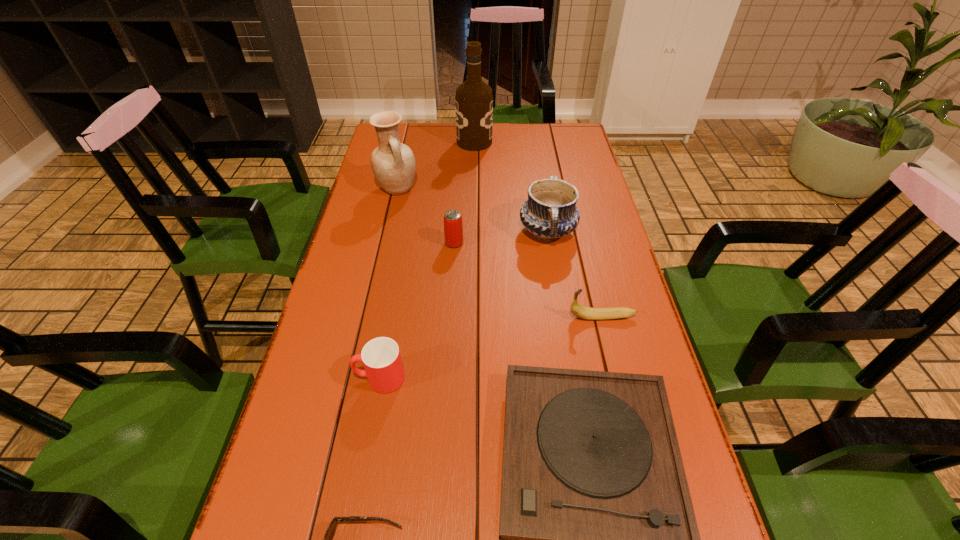
I want to click on pottery that is positioned at the left edge, so click(393, 163).

This screenshot has height=540, width=960. In order to click on cup that is at the left edge in this screenshot , I will do `click(381, 358)`.

Where is `pottery that is at the right edge`? The width and height of the screenshot is (960, 540). pottery that is at the right edge is located at coordinates click(550, 212).

Where is `banana that is positioned at the right edge`? The height and width of the screenshot is (540, 960). banana that is positioned at the right edge is located at coordinates (587, 313).

Where is `free region at the far edge of the desktop`? free region at the far edge of the desktop is located at coordinates coord(456,154).

The height and width of the screenshot is (540, 960). Identify the location of free space at the left edge. (368, 191).

The image size is (960, 540). In the image, there is a desktop. Identify the location of vacant space at the right edge. (607, 334).

This screenshot has width=960, height=540. In the image, there is a desktop. Identify the location of vacant space at the far right corner. (549, 130).

Locate an element on the screen. This screenshot has height=540, width=960. vacant point located between the nearer pottery and the cup is located at coordinates (464, 305).

At what (x,y) coordinates should I click in order to perform the action: click on free spot between the beer can and the tallest object. Please return your answer as a coordinate pair (x, y). The width and height of the screenshot is (960, 540). Looking at the image, I should click on (465, 193).